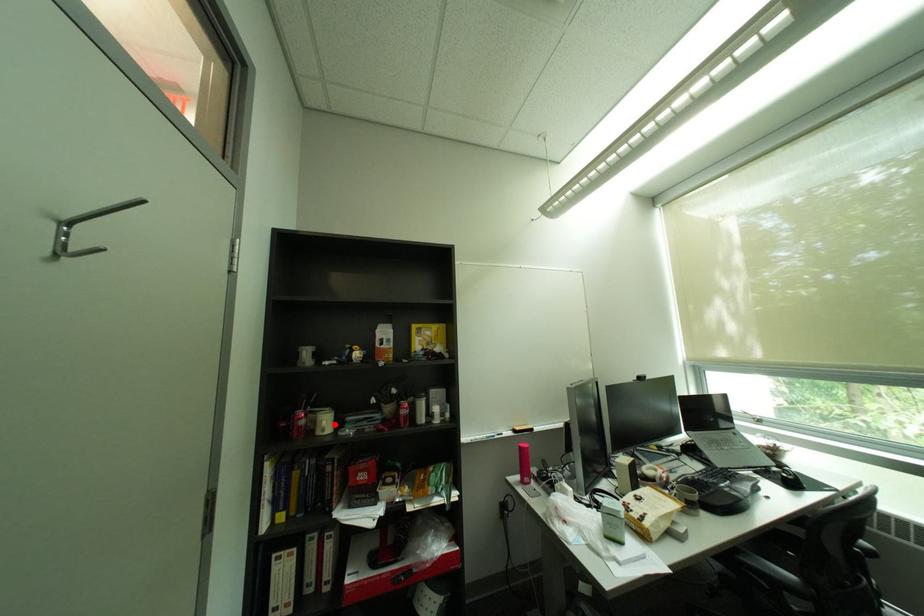
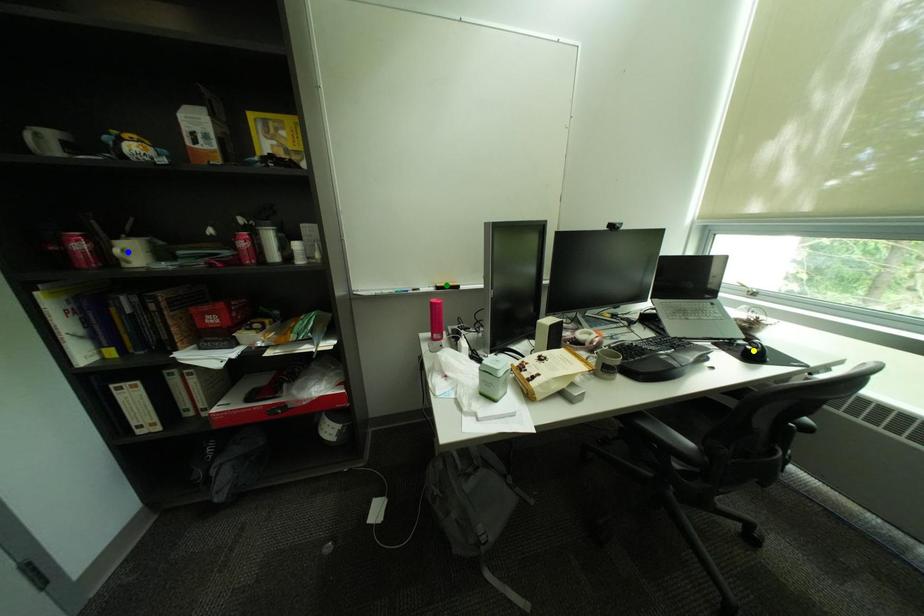
Question: I am providing you with two images of the same scene from different viewpoints. A red point is marked on the first image. You are given multiple points on the second image. Which point in image 2 is actually the same real-world point as the red point in image 1?

Choices:
 (A) green point
 (B) blue point
 (C) yellow point

Answer: (B)